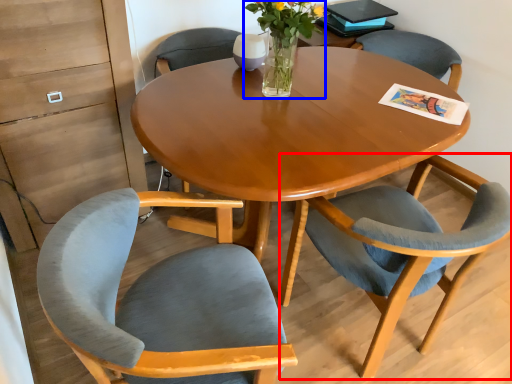
Question: Which of the following is the closest to the observer, chair (highlighted by a red box) or floral arrangement (highlighted by a blue box)?

Choices:
 (A) chair
 (B) floral arrangement

Answer: (A)